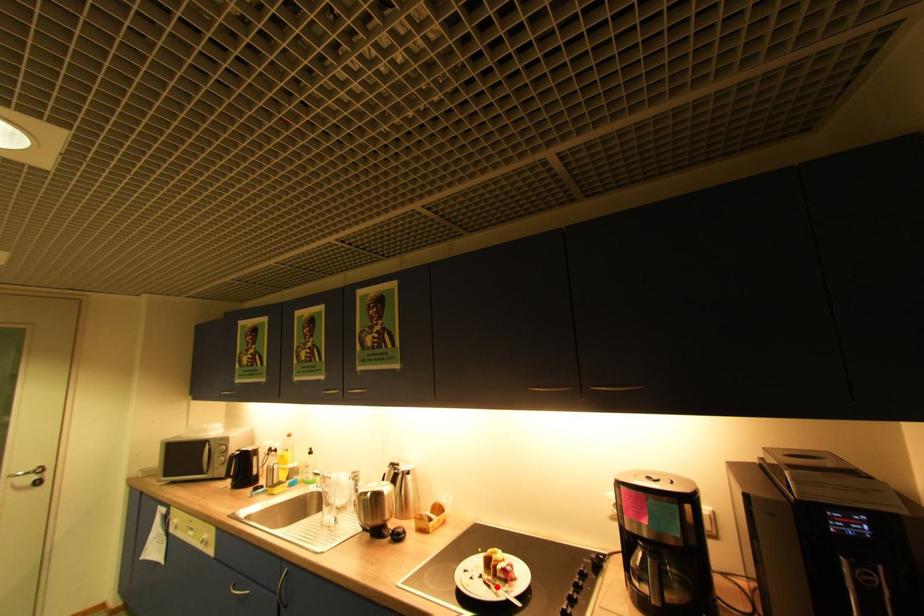
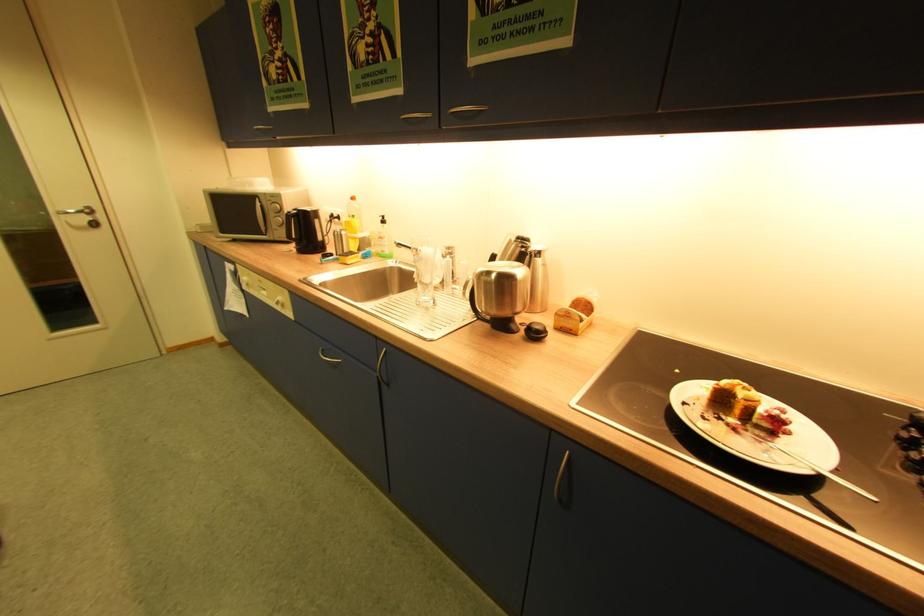
Where in the second image is the point corresponding to the highlighted location from the first image?

(746, 432)